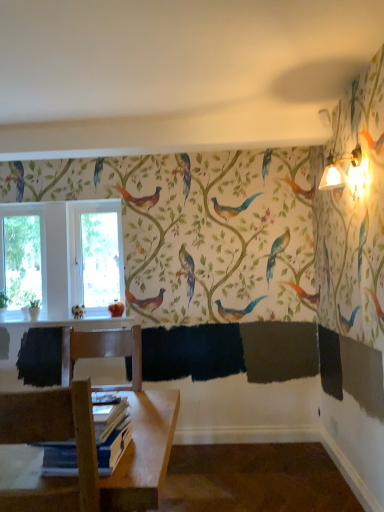
Question: Is blue paper book at lower left to the left of wooden chair at lower left from the viewer's perspective?

Choices:
 (A) yes
 (B) no

Answer: (B)

Question: Is wooden chair at lower left surrounded by blue paper book at lower left?

Choices:
 (A) no
 (B) yes

Answer: (A)

Question: Are blue paper book at lower left and wooden chair at lower left making contact?

Choices:
 (A) yes
 (B) no

Answer: (B)

Question: Considering the relative sizes of blue paper book at lower left and wooden chair at lower left in the image provided, is blue paper book at lower left wider than wooden chair at lower left?

Choices:
 (A) yes
 (B) no

Answer: (B)

Question: Would you say blue paper book at lower left is a long distance from wooden chair at lower left?

Choices:
 (A) yes
 (B) no

Answer: (B)

Question: From their relative heights in the image, would you say matte white bird at lower left is taller or shorter than blue paper book at lower left?

Choices:
 (A) short
 (B) tall

Answer: (B)

Question: Is point (76, 316) positioned closer to the camera than point (112, 433)?

Choices:
 (A) farther
 (B) closer

Answer: (A)

Question: Looking at their shapes, would you say matte white bird at lower left is wider or thinner than blue paper book at lower left?

Choices:
 (A) thin
 (B) wide

Answer: (A)

Question: From a real-world perspective, is matte white bird at lower left above or below blue paper book at lower left?

Choices:
 (A) below
 (B) above

Answer: (B)

Question: From the image's perspective, is wooden chair at lower left above or below matte white bird at lower left?

Choices:
 (A) above
 (B) below

Answer: (B)

Question: Is wooden chair at lower left taller or shorter than matte white bird at lower left?

Choices:
 (A) short
 (B) tall

Answer: (B)

Question: Considering the positions of point (24, 439) and point (82, 312), is point (24, 439) closer or farther from the camera than point (82, 312)?

Choices:
 (A) farther
 (B) closer

Answer: (B)

Question: Would you say wooden chair at lower left is inside or outside matte white bird at lower left?

Choices:
 (A) outside
 (B) inside

Answer: (A)

Question: Based on their positions, is matte white bird at lower left located to the left or right of transparent glass window at left, marked as the 2th window screen in a right-to-left arrangement?

Choices:
 (A) right
 (B) left

Answer: (A)

Question: From the image's perspective, is matte white bird at lower left above or below transparent glass window at left, positioned as the first window screen in left-to-right order?

Choices:
 (A) above
 (B) below

Answer: (B)